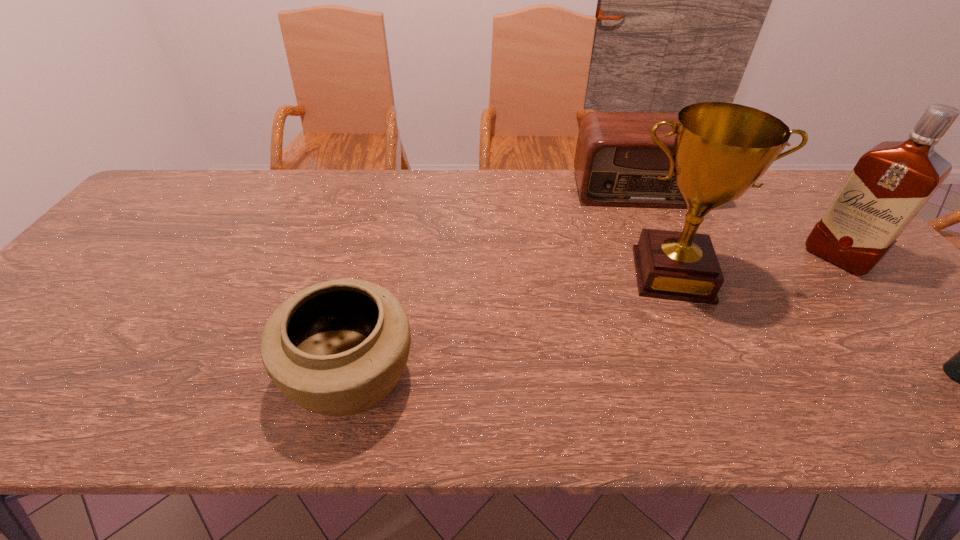
You are a GUI agent. You are given a task and a screenshot of the screen. Output one action in this format:
    pyautogui.click(x=<x>, y=<y>)
    Task: Click on the blank area located 0.170m on the front label of the liquor
    Image resolution: width=960 pixels, height=540 pixels.
    Given the screenshot: What is the action you would take?
    pyautogui.click(x=792, y=300)

The height and width of the screenshot is (540, 960). In order to click on free spot located on the front panel of the farthest object in this screenshot , I will do `click(652, 231)`.

At what (x,y) coordinates should I click in order to perform the action: click on free location located 0.290m on the front panel of the farthest object. Please return your answer as a coordinate pair (x, y). The width and height of the screenshot is (960, 540). Looking at the image, I should click on (669, 275).

You are a GUI agent. You are given a task and a screenshot of the screen. Output one action in this format:
    pyautogui.click(x=<x>, y=<y>)
    Task: Click on the vacant space located 0.130m on the front panel of the farthest object
    
    Given the screenshot: What is the action you would take?
    pyautogui.click(x=655, y=237)

Where is `object located in the far edge section of the desktop`? This screenshot has width=960, height=540. object located in the far edge section of the desktop is located at coordinates (617, 163).

I want to click on object at the near edge, so click(336, 348).

Identify the location of object that is at the right edge. (890, 183).

The width and height of the screenshot is (960, 540). Find the location of `free space at the far edge of the desktop`. free space at the far edge of the desktop is located at coordinates (451, 187).

Image resolution: width=960 pixels, height=540 pixels. In the image, there is a desktop. In order to click on vacant area at the near edge in this screenshot , I will do tap(259, 367).

In the image, there is a desktop. Identify the location of vacant space at the left edge. (60, 345).